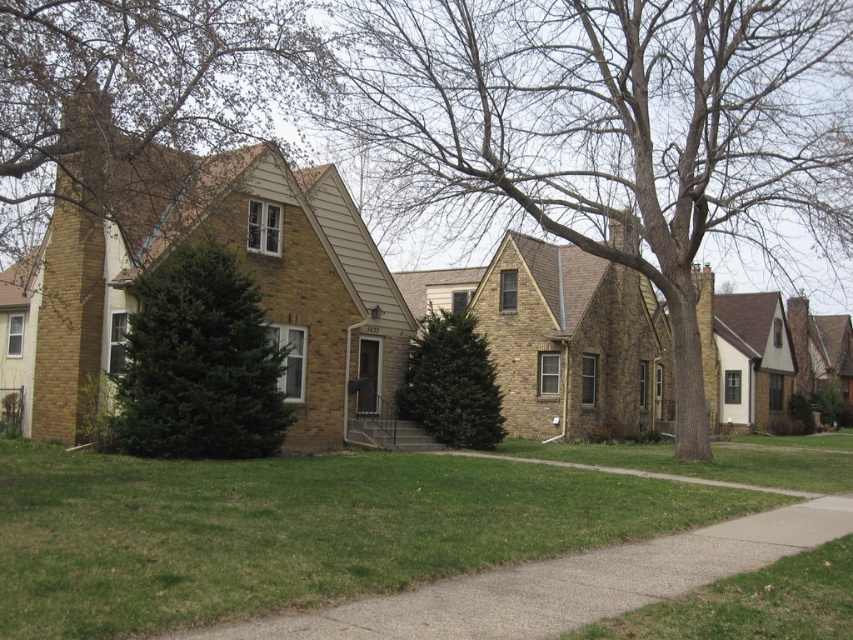
You are a drone operator trying to capture aerial footage of the suburban neighborhood. You need to avoid flying over the brown textured tree at upper left. Based on the coordinates provided, which direction should you steer the drone to stay clear of the tree?

The brown textured tree at upper left is located at coordinates point (x=137, y=84). To avoid it, steer the drone away from that specific point, either to the right or upwards depending on the flight path.

You are standing in the middle of the lawn and want to water the brown textured tree at center. If your garden hose can reach 50 feet, will you be able to water it without moving closer?

The brown textured tree at center and viewer are 50.51 feet apart. Since the hose can only reach 50 feet, you will need to move closer to reach it.

You are a gardener planning to trim the branches of both the brown textured tree at center and the brown textured tree at upper left. Based on their positions, which tree would you need to climb higher to reach its branches?

The brown textured tree at upper left is higher up in the image than the brown textured tree at center, so you would need to climb higher to reach its branches.